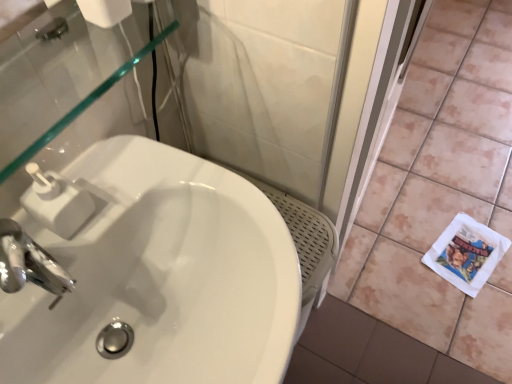
Question: From a real-world perspective, is white paper at lower right physically located above or below white glossy sink at center?

Choices:
 (A) above
 (B) below

Answer: (B)

Question: In terms of size, does white paper at lower right appear bigger or smaller than white glossy sink at center?

Choices:
 (A) small
 (B) big

Answer: (A)

Question: Based on their relative distances, which object is farther from the white glossy sink at center?

Choices:
 (A) white plastic soap dispenser at upper left
 (B) white matte toilet paper at upper left
 (C) white ceramic tile at lower right
 (D) transparent glass mirror at upper left
 (E) white paper at lower right

Answer: (E)

Question: Estimate the real-world distances between objects in this image. Which object is closer to the white glossy sink at center?

Choices:
 (A) white ceramic tile at lower right
 (B) white matte toilet paper at upper left
 (C) white paper at lower right
 (D) white plastic soap dispenser at upper left
 (E) transparent glass mirror at upper left

Answer: (D)